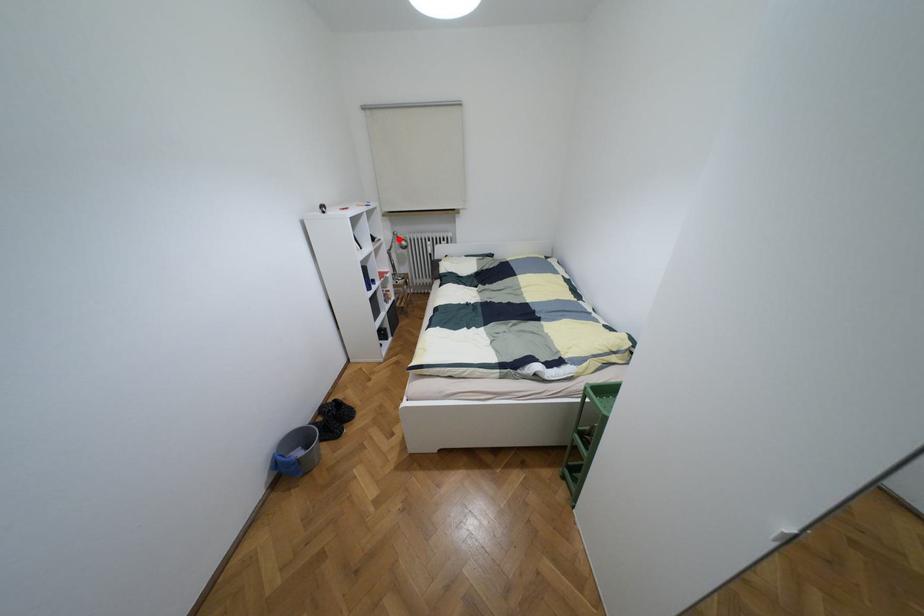
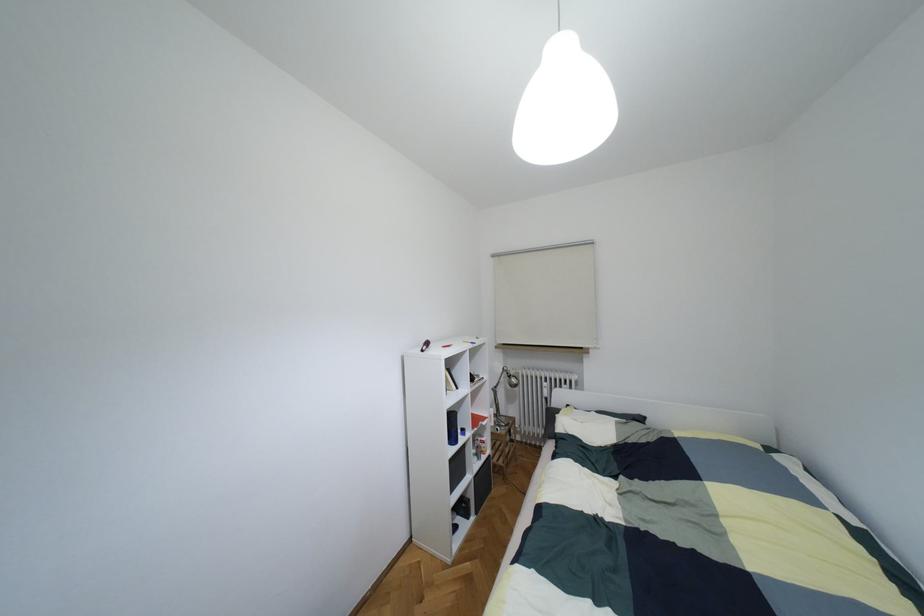
Question: I am providing you with two images of the same scene from different viewpoints. In image1, a red point is highlighted. Considering the same 3D point in image2, which of the following is correct?

Choices:
 (A) It is closer
 (B) It is farther

Answer: (B)